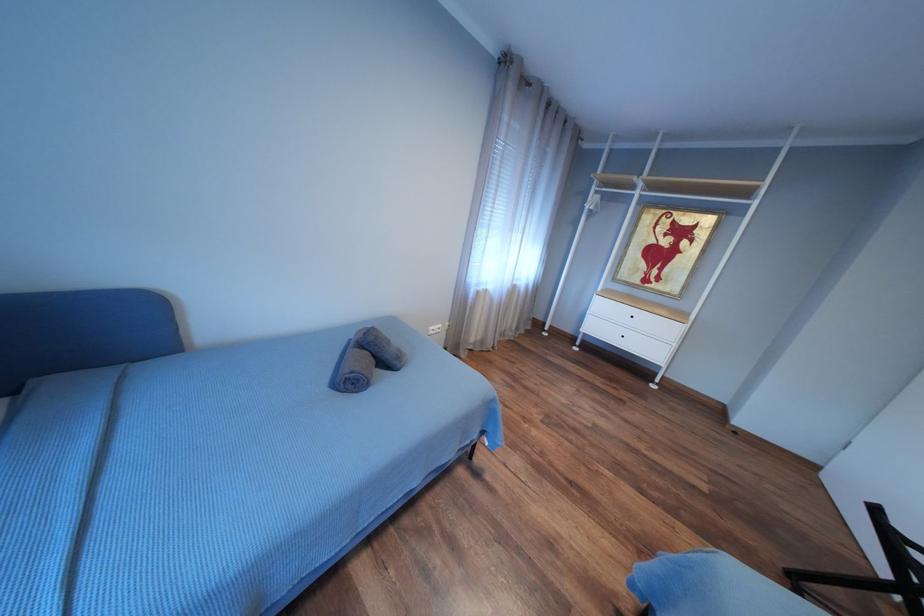
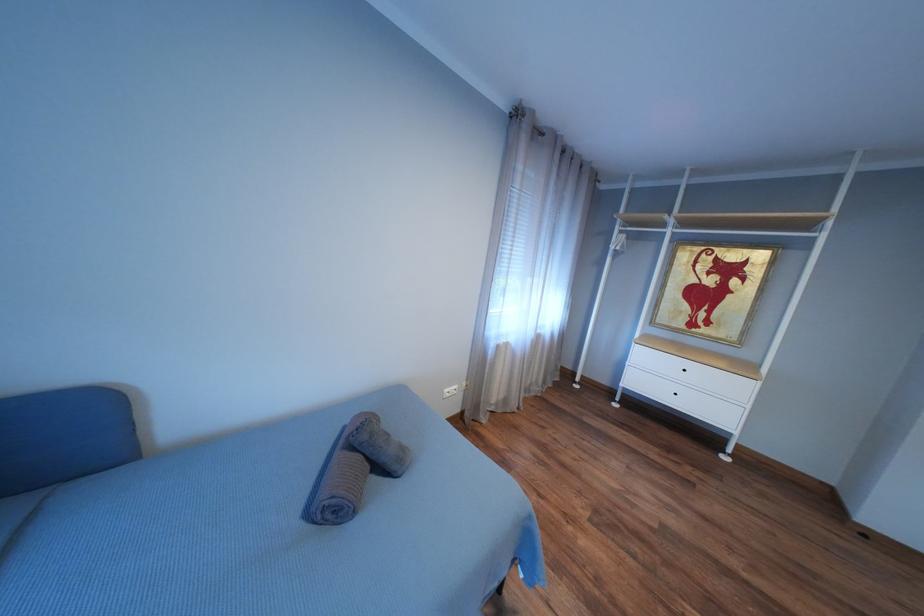
Question: What movement of the cameraman would produce the second image?

Choices:
 (A) Left
 (B) Right
 (C) Forward
 (D) Backward

Answer: (C)